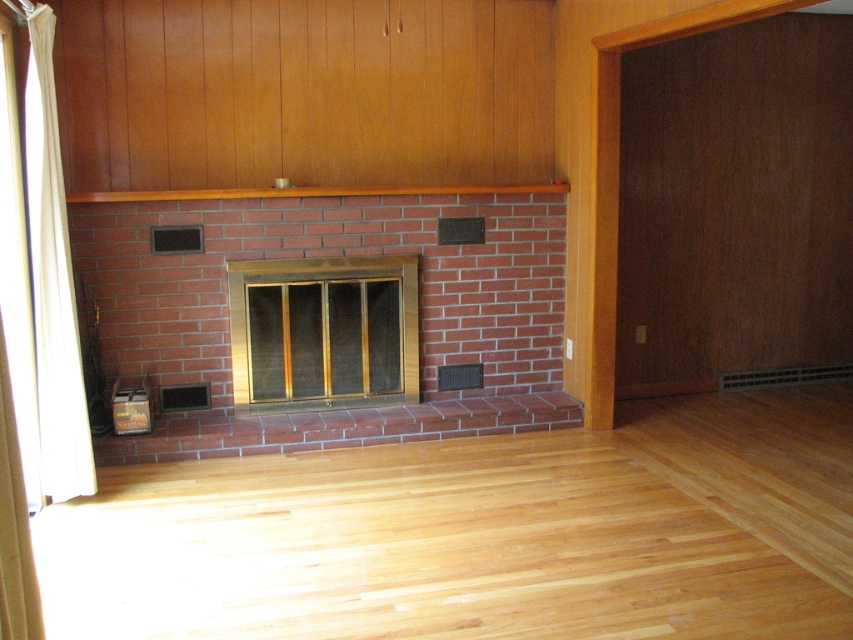
Looking at this image, you are an interior designer planning to hang a large painting above the red brick fireplace at center. The painting is as wide as the fireplace. Will it extend beyond the brown wood mantle at upper center?

The red brick fireplace at center is wider than the brown wood mantle at upper center. Therefore, a painting as wide as the fireplace will extend beyond the mantle since the mantle is narrower.

You are standing in the cozy interior space with the central brick fireplace. You notice a point at coordinates (51, 284). What object is located at this point?

The point at coordinates (51, 284) corresponds to the white fabric curtain at left.

You are decorating the room and want to hang a picture above the red brick fireplace at center. Is the brown wood mantle at upper center in a suitable position to support the picture?

The brown wood mantle at upper center is located above the red brick fireplace at center, so it is in a suitable position to support the picture.